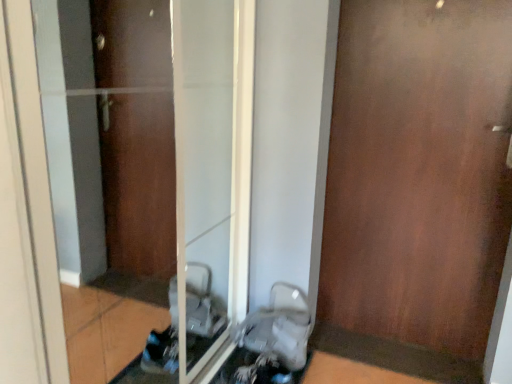
What do you see at coordinates (417, 185) in the screenshot?
I see `brown wood door at right` at bounding box center [417, 185].

The image size is (512, 384). What do you see at coordinates (278, 328) in the screenshot?
I see `white plastic baby carriage at lower center` at bounding box center [278, 328].

Where is `transparent glass door at center`? The image size is (512, 384). transparent glass door at center is located at coordinates (211, 165).

Based on the photo, between brown wood door at right and white plastic baby carriage at lower center, which one appears on the right side from the viewer's perspective?

Positioned to the right is brown wood door at right.

Is brown wood door at right located outside white plastic baby carriage at lower center?

Yes, brown wood door at right is not within white plastic baby carriage at lower center.

From their relative heights in the image, would you say brown wood door at right is taller or shorter than white plastic baby carriage at lower center?

Clearly, brown wood door at right is taller compared to white plastic baby carriage at lower center.

Considering the positions of points (419, 39) and (269, 321), is point (419, 39) closer to camera compared to point (269, 321)?

That is True.

Considering the relative sizes of transparent glass door at center and white plastic baby carriage at lower center in the image provided, is transparent glass door at center wider than white plastic baby carriage at lower center?

No.

Could you tell me if transparent glass door at center is turned towards white plastic baby carriage at lower center?

Yes, transparent glass door at center is aimed at white plastic baby carriage at lower center.

In the scene shown: Considering their positions, is transparent glass door at center located in front of or behind white plastic baby carriage at lower center?

Visually, transparent glass door at center is located in front of white plastic baby carriage at lower center.

From a real-world perspective, is transparent glass door at center located beneath white plastic baby carriage at lower center?

No, from a real-world perspective, transparent glass door at center is not below white plastic baby carriage at lower center.

Considering the sizes of objects transparent glass door at center and brown wood door at right in the image provided, who is thinner, transparent glass door at center or brown wood door at right?

transparent glass door at center is thinner.

Is the surface of transparent glass door at center in direct contact with brown wood door at right?

No, transparent glass door at center is not making contact with brown wood door at right.

Is transparent glass door at center positioned with its back to brown wood door at right?

That's not correct — transparent glass door at center is not looking away from brown wood door at right.

Can you tell me how much transparent glass door at center and brown wood door at right differ in facing direction?

91.4 degrees separate the facing orientations of transparent glass door at center and brown wood door at right.

Between point (294, 289) and point (384, 133), which one is positioned behind?

The point (294, 289) is more distant.

From the picture: From a real-world perspective, which object stands above the other?

brown wood door at right is physically above.

There is a white plastic baby carriage at lower center. Identify the location of door above it (from a real-world perspective). This screenshot has width=512, height=384. (417, 185).

From the image's perspective, between white plastic baby carriage at lower center and brown wood door at right, which one is located above?

brown wood door at right, from the image's perspective.

Would you consider white plastic baby carriage at lower center to be distant from transparent glass door at center?

Actually, white plastic baby carriage at lower center and transparent glass door at center are a little close together.

This screenshot has height=384, width=512. What are the coordinates of `glass door located on the left of white plastic baby carriage at lower center` in the screenshot? It's located at (211, 165).

From their relative heights in the image, would you say white plastic baby carriage at lower center is taller or shorter than transparent glass door at center?

Considering their sizes, white plastic baby carriage at lower center has less height than transparent glass door at center.

Is point (280, 353) closer to viewer compared to point (208, 317)?

Yes, point (280, 353) is in front of point (208, 317).

In the scene shown: Considering the positions of objects brown wood door at right and transparent glass door at center in the image provided, who is more to the left, brown wood door at right or transparent glass door at center?

transparent glass door at center is more to the left.

You are a GUI agent. You are given a task and a screenshot of the screen. Output one action in this format:
    pyautogui.click(x=<x>, y=<y>)
    Task: Click on the door above the transparent glass door at center (from the image's perspective)
    The height and width of the screenshot is (384, 512).
    Given the screenshot: What is the action you would take?
    pyautogui.click(x=417, y=185)

Is brown wood door at right not near transparent glass door at center?

No, brown wood door at right is not far from transparent glass door at center.

Between brown wood door at right and transparent glass door at center, which one is positioned in front?

transparent glass door at center.

This screenshot has height=384, width=512. I want to click on door that appears on the right of white plastic baby carriage at lower center, so click(417, 185).

Find the location of a particular element. Image resolution: width=512 pixels, height=384 pixels. glass door lying in front of the white plastic baby carriage at lower center is located at coordinates pyautogui.click(x=211, y=165).

Which object lies nearer to the anchor point brown wood door at right, transparent glass door at center or white plastic baby carriage at lower center?

white plastic baby carriage at lower center is closer to brown wood door at right.

Considering their positions, is white plastic baby carriage at lower center positioned closer to transparent glass door at center than brown wood door at right?

white plastic baby carriage at lower center.

Based on their spatial positions, is brown wood door at right or white plastic baby carriage at lower center closer to transparent glass door at center?

white plastic baby carriage at lower center lies closer to transparent glass door at center than the other object.

Estimate the real-world distances between objects in this image. Which object is further from white plastic baby carriage at lower center, transparent glass door at center or brown wood door at right?

brown wood door at right is positioned further to the anchor white plastic baby carriage at lower center.

Based on their spatial positions, is brown wood door at right or transparent glass door at center closer to white plastic baby carriage at lower center?

Among the two, transparent glass door at center is located nearer to white plastic baby carriage at lower center.

Considering their positions, is white plastic baby carriage at lower center positioned closer to brown wood door at right than transparent glass door at center?

white plastic baby carriage at lower center is closer to brown wood door at right.

The image size is (512, 384). In order to click on door between transparent glass door at center and white plastic baby carriage at lower center from front to back in this screenshot , I will do `click(417, 185)`.